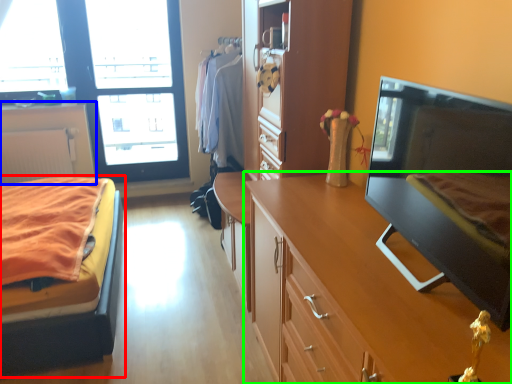
Question: Which object is the farthest from bed (highlighted by a red box)? Choose among these: cabinetry (highlighted by a blue box) or cabinetry (highlighted by a green box).

Choices:
 (A) cabinetry
 (B) cabinetry

Answer: (A)